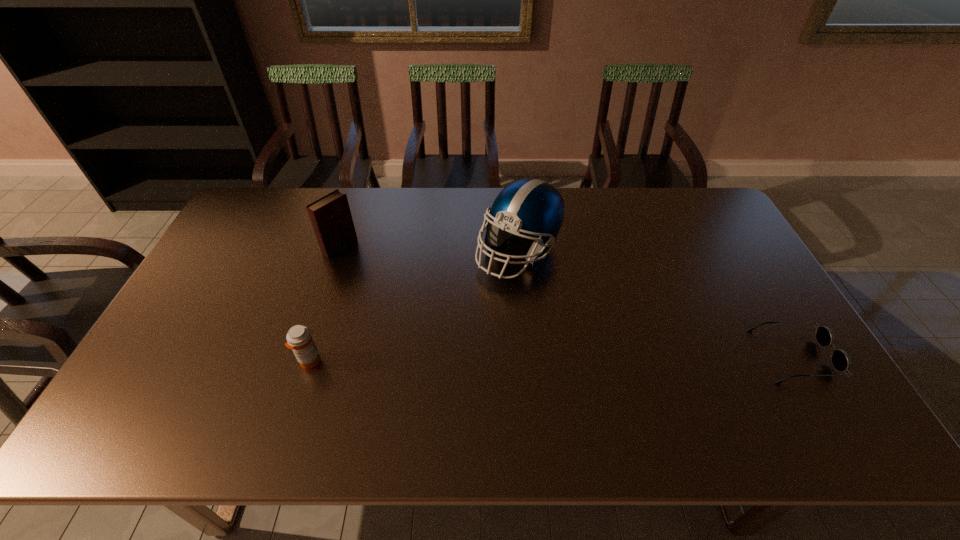
In the image, there is a desktop. Where is `vacant space at the left edge`? vacant space at the left edge is located at coordinates (234, 277).

Locate an element on the screen. This screenshot has width=960, height=540. vacant space at the right edge of the desktop is located at coordinates (725, 285).

Where is `vacant space at the far left corner`? vacant space at the far left corner is located at coordinates (247, 219).

This screenshot has height=540, width=960. I want to click on free space at the far right corner, so click(677, 217).

Image resolution: width=960 pixels, height=540 pixels. What are the coordinates of `vacant point located between the rightmost object and the diary` in the screenshot? It's located at point(567,301).

Identify the location of blank region between the third object from left to right and the third shortest object. (429, 249).

Image resolution: width=960 pixels, height=540 pixels. Find the location of `vacant space in between the third shortest object and the third tallest object`. vacant space in between the third shortest object and the third tallest object is located at coordinates (324, 303).

Where is `vacant space in between the diary and the football helmet`? This screenshot has width=960, height=540. vacant space in between the diary and the football helmet is located at coordinates (429, 249).

Where is `free space between the sunglasses and the third tallest object`? This screenshot has height=540, width=960. free space between the sunglasses and the third tallest object is located at coordinates (552, 359).

Image resolution: width=960 pixels, height=540 pixels. Find the location of `free point between the medicine and the shortest object`. free point between the medicine and the shortest object is located at coordinates (552, 359).